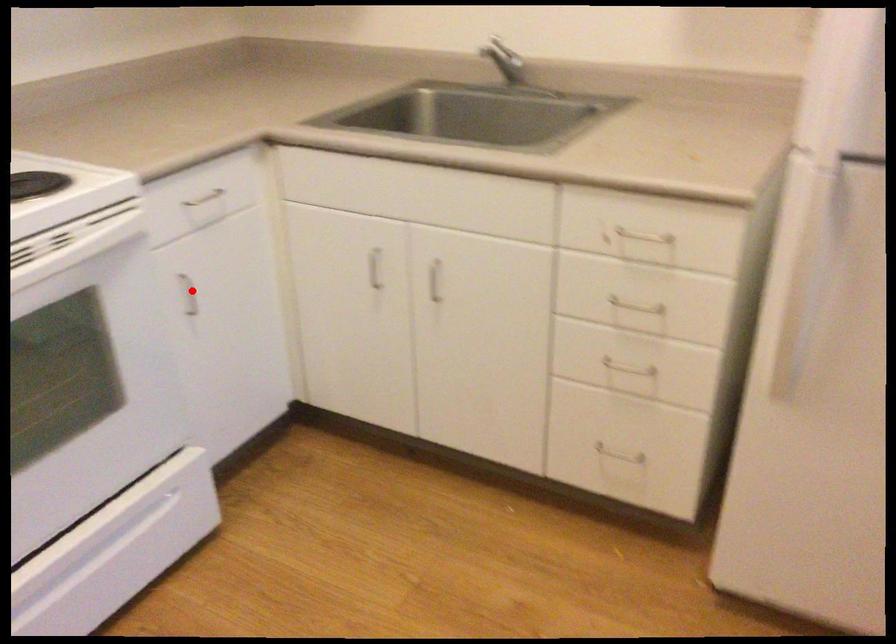
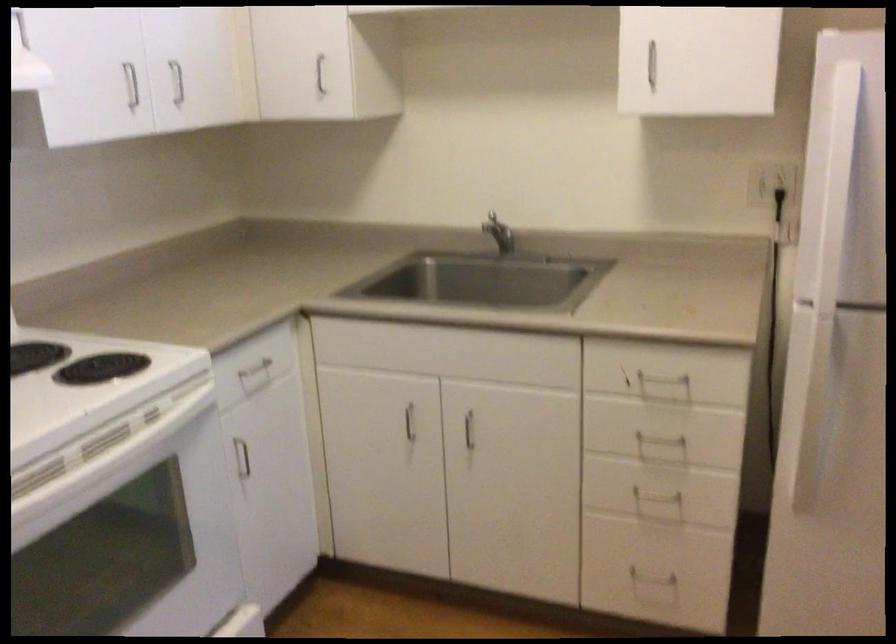
The point at the highlighted location is marked in the first image. Where is the corresponding point in the second image?

(242, 458)